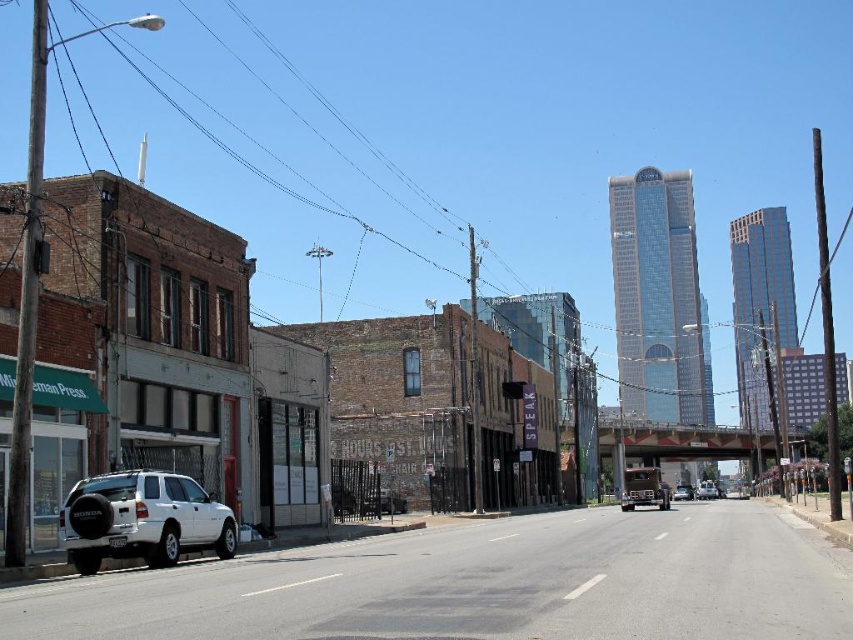
Question: Which object appears farthest from the camera in this image?

Choices:
 (A) white matte truck at center
 (B) metallic silver sedan at center

Answer: (A)

Question: Is white matte suv at lower left further to camera compared to metallic silver sedan at center?

Choices:
 (A) no
 (B) yes

Answer: (A)

Question: Is white matte suv at lower left further to the viewer compared to metallic silver sedan at center?

Choices:
 (A) yes
 (B) no

Answer: (B)

Question: Is white matte truck at center wider than metallic silver sedan at center?

Choices:
 (A) no
 (B) yes

Answer: (B)

Question: Which is farther from the white matte truck at center?

Choices:
 (A) white matte suv at lower left
 (B) metallic silver sedan at center

Answer: (A)

Question: Which object is the farthest from the white matte suv at lower left?

Choices:
 (A) white matte truck at center
 (B) metallic silver sedan at center

Answer: (A)